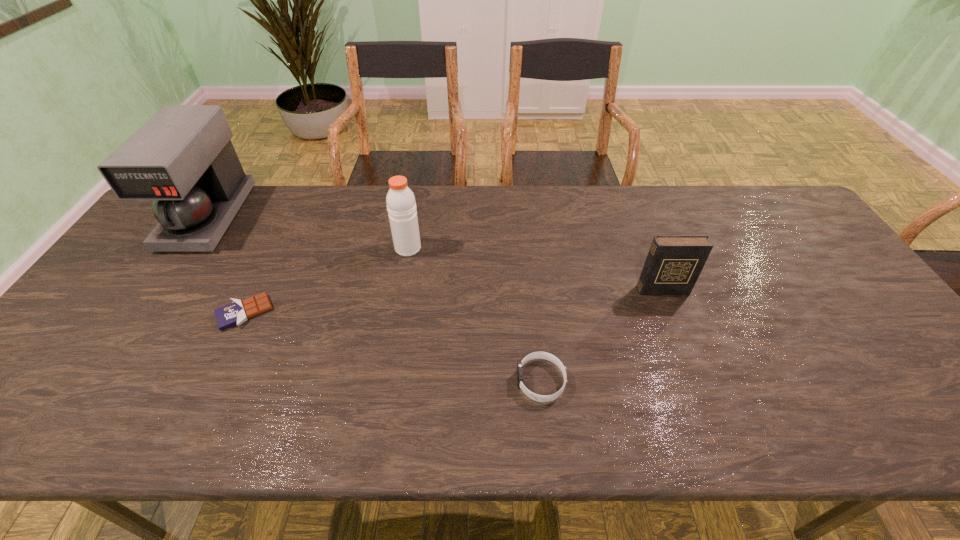
Where is `object present at the far left corner`? object present at the far left corner is located at coordinates (182, 158).

This screenshot has height=540, width=960. In order to click on vacant area at the far edge in this screenshot , I will do `click(378, 203)`.

Locate an element on the screen. The height and width of the screenshot is (540, 960). blank space at the near edge of the desktop is located at coordinates (396, 413).

You are a GUI agent. You are given a task and a screenshot of the screen. Output one action in this format:
    pyautogui.click(x=<x>, y=<y>)
    Task: Click on the free point at the left edge
    The image size is (960, 540).
    Given the screenshot: What is the action you would take?
    pyautogui.click(x=144, y=264)

Find the location of a particular element. vacant area at the right edge of the desktop is located at coordinates (789, 277).

At what (x,y) coordinates should I click in order to perform the action: click on free space between the second shortest object and the diary. Please return your answer as a coordinate pair (x, y). This screenshot has height=540, width=960. Looking at the image, I should click on (602, 335).

This screenshot has width=960, height=540. Identify the location of empty space between the diary and the wristband. (602, 335).

Locate an element on the screen. The height and width of the screenshot is (540, 960). free point between the third object from left to right and the nearest object is located at coordinates (474, 314).

This screenshot has width=960, height=540. What are the coordinates of `free spot between the shaker and the fourth object from right to left` in the screenshot? It's located at (326, 280).

You are a GUI agent. You are given a task and a screenshot of the screen. Output one action in this format:
    pyautogui.click(x=<x>, y=<y>)
    Task: Click on the vacant space that's between the fourth tallest object and the leftmost object
    
    Given the screenshot: What is the action you would take?
    (375, 299)